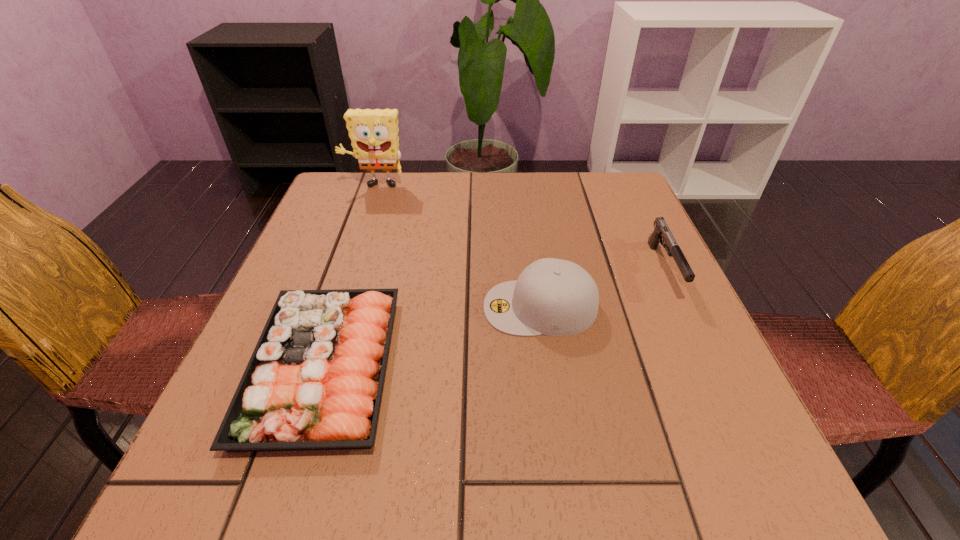
The image size is (960, 540). What are the coordinates of `free space located 0.250m at the muzzle end of the gun` in the screenshot? It's located at (734, 418).

I want to click on free space located 0.130m on the right of the shortest object, so click(468, 367).

The height and width of the screenshot is (540, 960). I want to click on object that is at the far edge, so click(374, 137).

Locate an element on the screen. The height and width of the screenshot is (540, 960). object that is at the near edge is located at coordinates (314, 381).

At what (x,y) coordinates should I click in order to perform the action: click on sponge positioned at the left edge. Please return your answer as a coordinate pair (x, y). Image resolution: width=960 pixels, height=540 pixels. Looking at the image, I should click on (374, 137).

At what (x,y) coordinates should I click in order to perform the action: click on platter that is at the left edge. Please return your answer as a coordinate pair (x, y). The width and height of the screenshot is (960, 540). Looking at the image, I should click on (314, 381).

This screenshot has height=540, width=960. Identify the location of object that is at the right edge. click(x=661, y=230).

Find the location of `object at the far left corner`. object at the far left corner is located at coordinates coord(374,137).

The width and height of the screenshot is (960, 540). Find the location of `object that is positioned at the near left corner`. object that is positioned at the near left corner is located at coordinates (314, 381).

The width and height of the screenshot is (960, 540). Identify the location of vacant space at the far edge of the desktop. (561, 180).